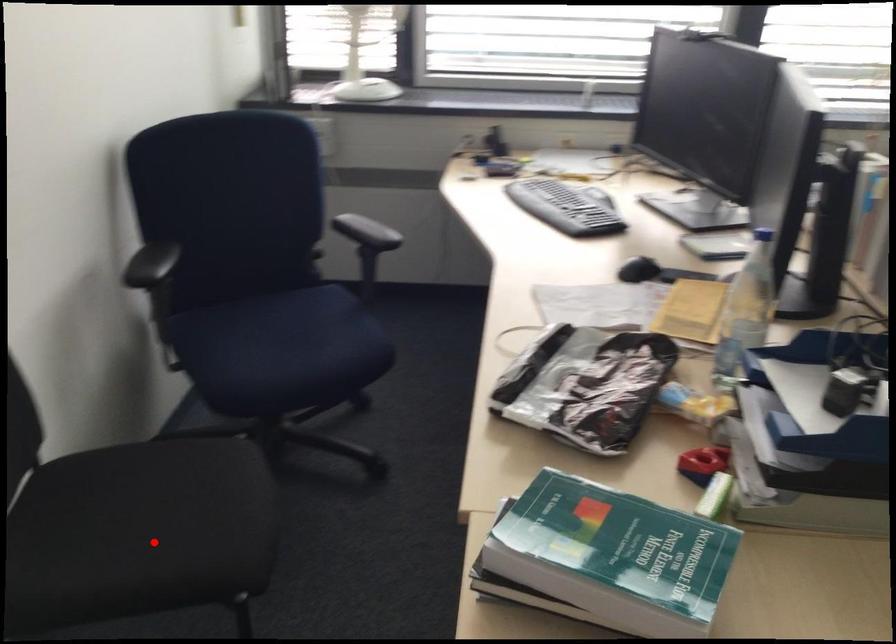
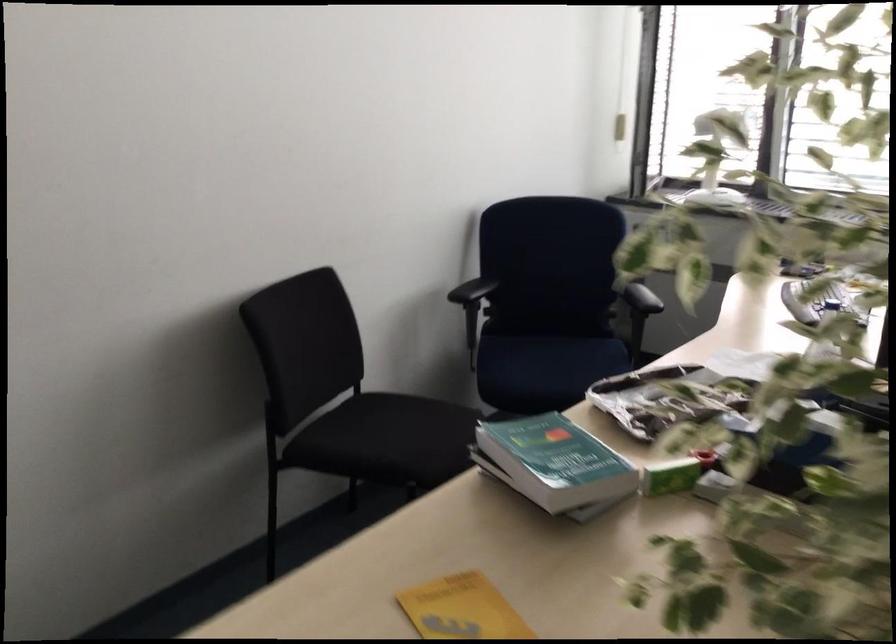
Question: A red point is marked in image1. In image2, is the corresponding 3D point closer to the camera or farther? Reply with the corresponding letter.

Choices:
 (A) The corresponding 3D point is closer.
 (B) The corresponding 3D point is farther.

Answer: (B)